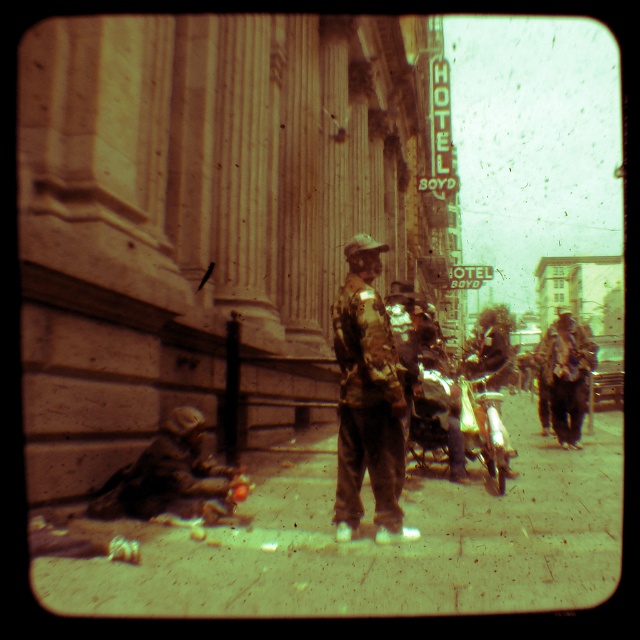
Image resolution: width=640 pixels, height=640 pixels. What do you see at coordinates (368, 400) in the screenshot?
I see `camouflage fabric jacket at center` at bounding box center [368, 400].

Between point (401, 401) and point (577, 336), which one is positioned behind?

Positioned behind is point (577, 336).

Find the location of a particular element. camouflage fabric jacket at center is located at coordinates (368, 400).

Between brown cardboard figure at lower left and brown leather jacket at center, which one has more height?

With more height is brown leather jacket at center.

Does brown cardboard figure at lower left have a lesser height compared to brown leather jacket at center?

Yes, brown cardboard figure at lower left is shorter than brown leather jacket at center.

Between point (173, 465) and point (570, 355), which one is positioned behind?

The point (570, 355) is behind.

Find the location of a particular element. brown cardboard figure at lower left is located at coordinates (172, 477).

Identify the location of smooth concrete sidewalk at lower left. (376, 544).

Does smooth concrete sidewalk at lower left have a lesser width compared to brown leather jacket at center?

Correct, smooth concrete sidewalk at lower left's width is less than brown leather jacket at center's.

Which is in front, point (285, 572) or point (557, 397)?

Point (285, 572) is more forward.

Find the location of a particular element. smooth concrete sidewalk at lower left is located at coordinates (376, 544).